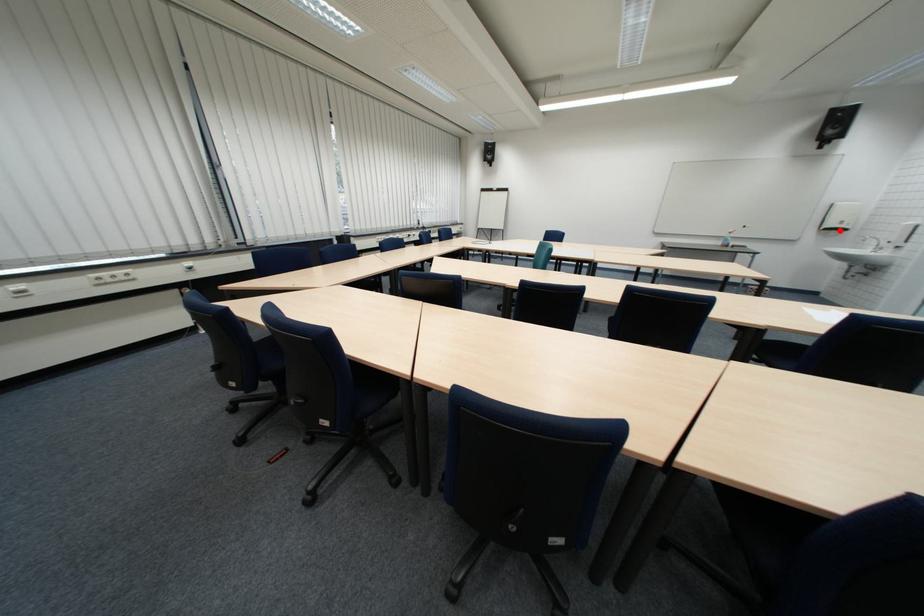
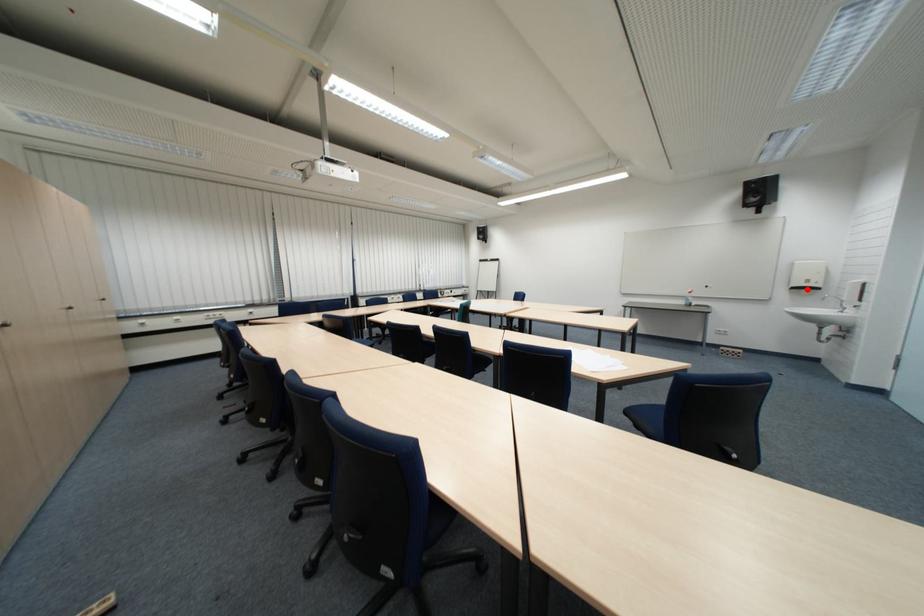
I am providing you with two images of the same scene from different viewpoints. A red point is marked on the first image and another point is marked on the second image. Is the red point in image1 aligned with the point shown in image2?

Yes